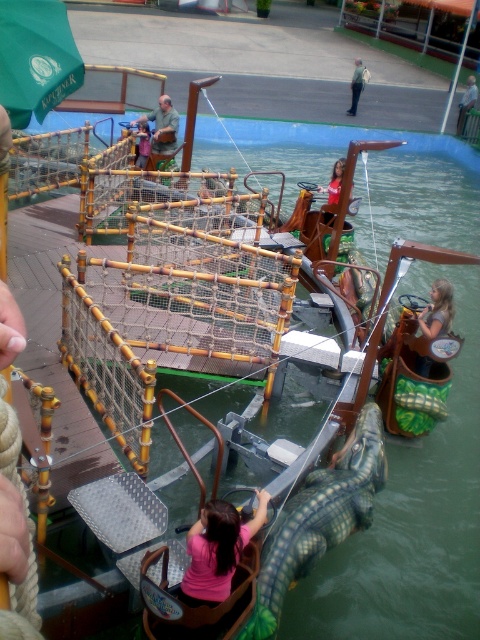
Question: Which point is closer to the camera taking this photo?

Choices:
 (A) (350, 113)
 (B) (469, 90)
 (C) (167, 97)

Answer: (C)

Question: Does brown leather jacket at upper center have a smaller size compared to pink fabric shirt at center?

Choices:
 (A) no
 (B) yes

Answer: (A)

Question: Can you confirm if pink matte shirt at center is wider than smooth brown hair at upper right?

Choices:
 (A) yes
 (B) no

Answer: (A)

Question: Can you confirm if smooth brown hair at upper right is smaller than pink fabric shirt at center?

Choices:
 (A) yes
 (B) no

Answer: (B)

Question: Which object is closer to the camera taking this photo?

Choices:
 (A) light blue jeans at upper center
 (B) matte brown shirt at upper center

Answer: (B)

Question: Which is nearer to the light blue jeans at upper center?

Choices:
 (A) pink fabric shirt at center
 (B) light brown wooden pole at upper right

Answer: (B)